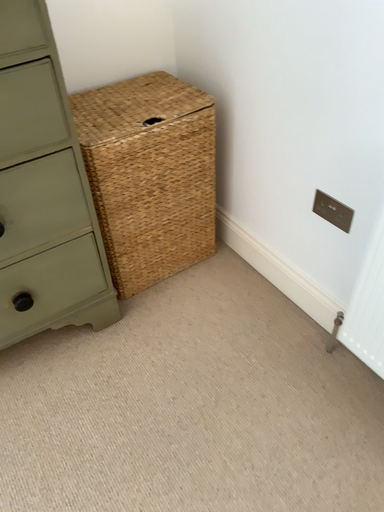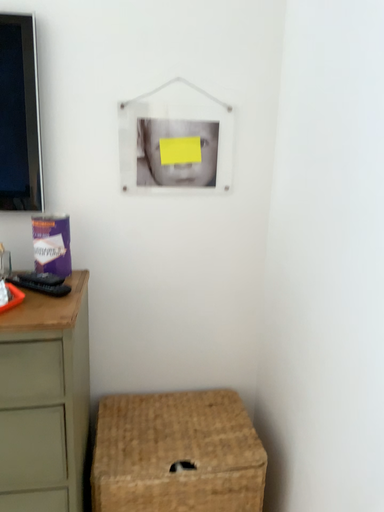
Question: How did the camera likely rotate when shooting the video?

Choices:
 (A) rotated downward
 (B) rotated upward

Answer: (B)